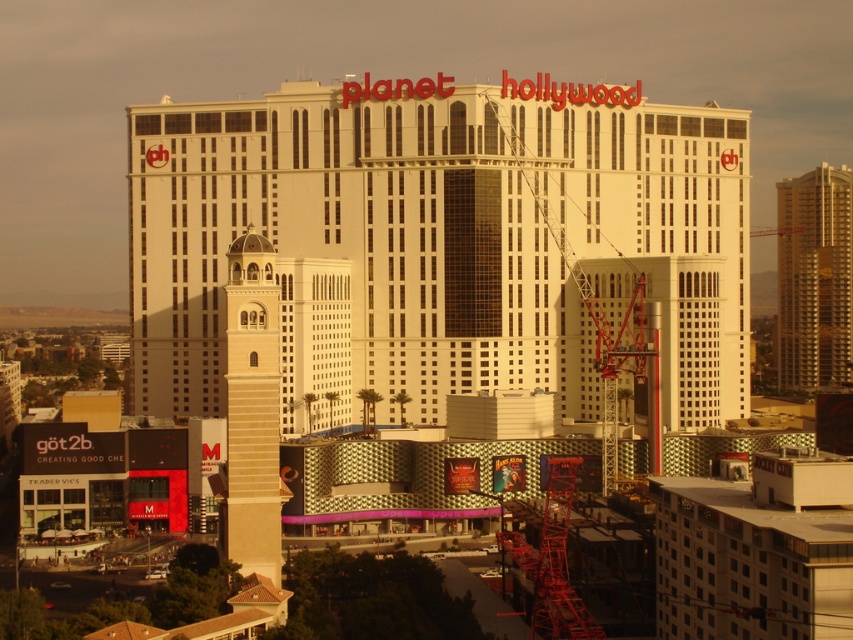
You are a delivery drone with a maximum flight range of 70 meters. You need to deliver a package from the white textured building at center to the gold metallic building at right. Can you complete this delivery without needing a recharge?

The distance between the white textured building at center and the gold metallic building at right is 72.98 meters, which exceeds the drone s 70 meter range. Therefore, the drone cannot complete the delivery without recharging.